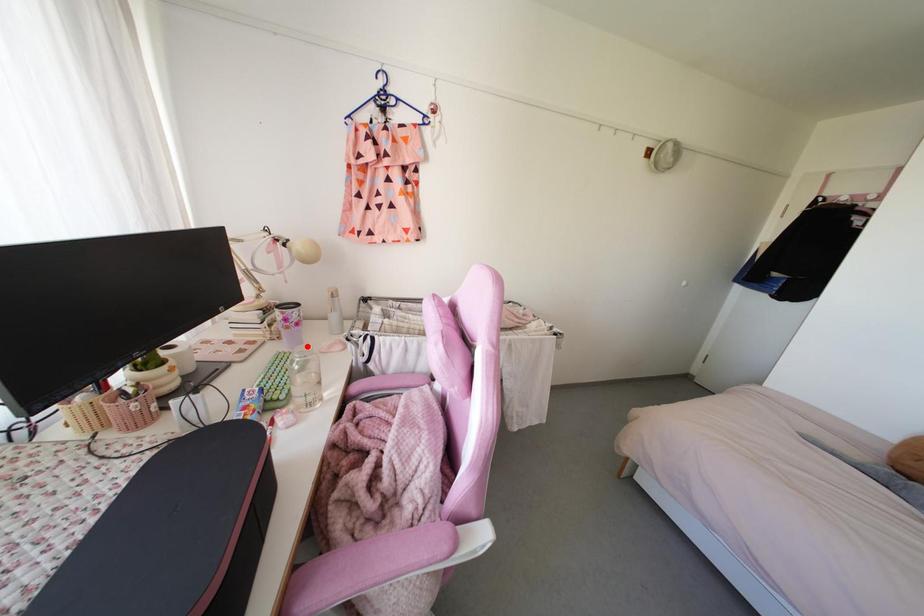
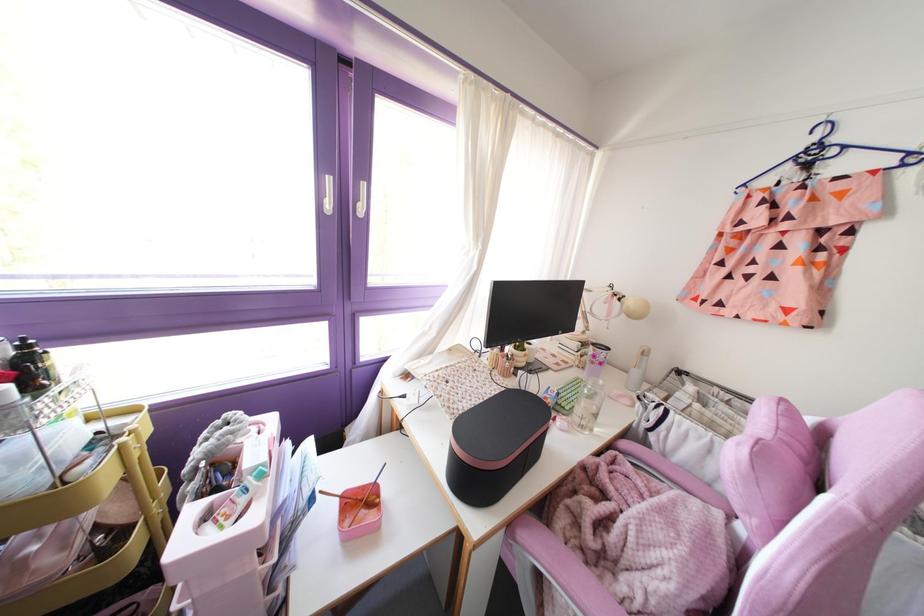
Where in the second image is the point corresponding to the highlighted location from the first image?

(601, 382)